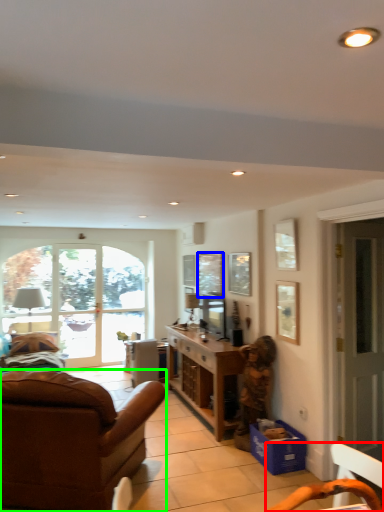
Question: Which object is positioned closest to chair (highlighted by a red box)? Select from window screen (highlighted by a blue box) and studio couch (highlighted by a green box).

Choices:
 (A) window screen
 (B) studio couch

Answer: (B)